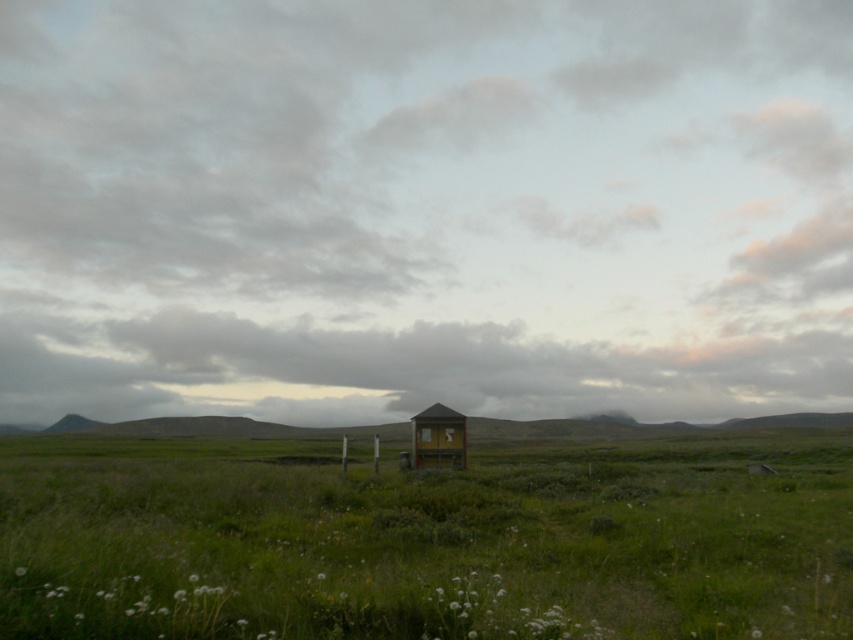
Question: Where is cloudy sky at upper center located in relation to wooden cabin at center in the image?

Choices:
 (A) above
 (B) below

Answer: (A)

Question: Which point appears closest to the camera in this image?

Choices:
 (A) (581, 168)
 (B) (38, 449)

Answer: (B)

Question: Among these points, which one is nearest to the camera?

Choices:
 (A) (248, 342)
 (B) (361, 513)
 (C) (450, 460)

Answer: (B)

Question: Does cloudy sky at upper center come in front of green grassy field at center?

Choices:
 (A) no
 (B) yes

Answer: (A)

Question: Which point appears farthest from the camera in this image?

Choices:
 (A) (531, 70)
 (B) (90, 564)
 (C) (447, 417)

Answer: (A)

Question: Does cloudy sky at upper center appear on the left side of green grassy field at center?

Choices:
 (A) no
 (B) yes

Answer: (A)